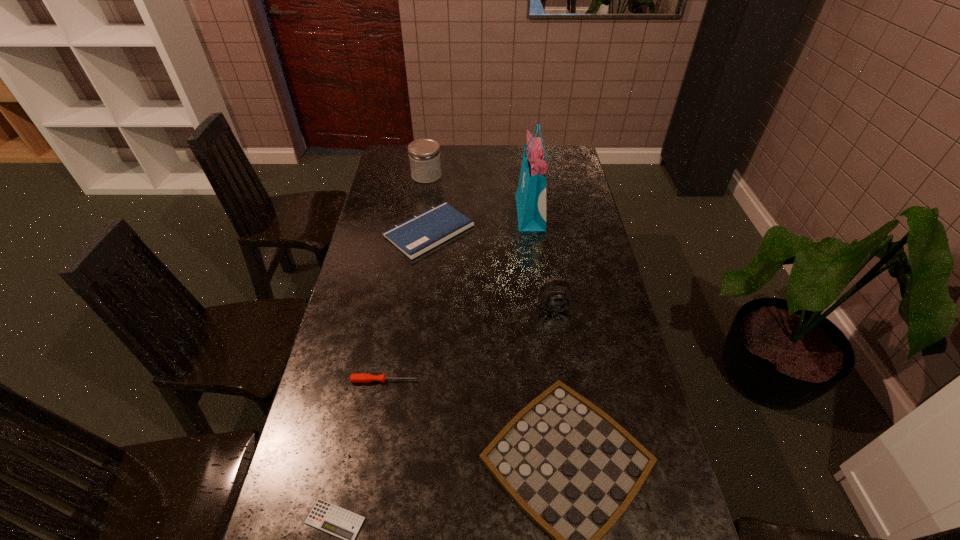
The height and width of the screenshot is (540, 960). I want to click on vacant space located 0.060m on the back of the fourth shortest object, so click(x=434, y=197).

This screenshot has height=540, width=960. In order to click on vacant space located 0.170m at the tip of the fifth farthest object in this screenshot , I will do `click(479, 381)`.

You are a GUI agent. You are given a task and a screenshot of the screen. Output one action in this format:
    pyautogui.click(x=<x>, y=<y>)
    Task: Click on the object present at the far edge
    
    Given the screenshot: What is the action you would take?
    pyautogui.click(x=424, y=154)

This screenshot has width=960, height=540. I want to click on jar situated at the left edge, so click(424, 154).

Where is `paperback book at the left edge`? The image size is (960, 540). paperback book at the left edge is located at coordinates (417, 235).

Where is `screwdriver positioned at the left edge`? The width and height of the screenshot is (960, 540). screwdriver positioned at the left edge is located at coordinates (360, 377).

Where is `object that is at the right edge`? Image resolution: width=960 pixels, height=540 pixels. object that is at the right edge is located at coordinates (556, 295).

Where is `object located at the far left corner`? This screenshot has height=540, width=960. object located at the far left corner is located at coordinates (424, 154).

Find the location of `vacant space at the far edge`. vacant space at the far edge is located at coordinates (x=504, y=152).

Identify the location of vacant region at the left edge of the desktop. (377, 198).